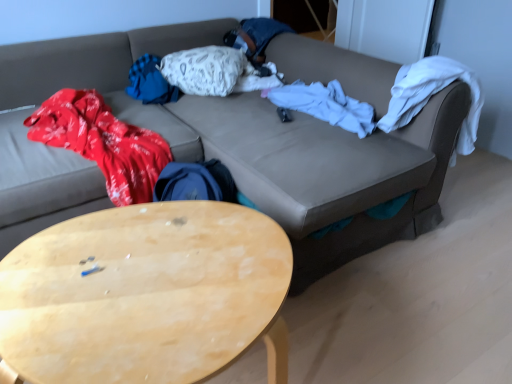
Identify the location of white soft blanket at center. The height and width of the screenshot is (384, 512). (325, 105).

Considering the points (218, 92) and (295, 100), which point is behind, point (218, 92) or point (295, 100)?

Positioned behind is point (218, 92).

Is white soft blanket at center completely or partially inside white textured pillow at center?

No, white soft blanket at center is located outside of white textured pillow at center.

Is white textured pillow at center with white soft blanket at center?

No, white textured pillow at center is not in contact with white soft blanket at center.

Is white textured pillow at center situated inside light wood/wooden coffee table at lower left or outside?

white textured pillow at center exists outside the volume of light wood/wooden coffee table at lower left.

Can you tell me how much white textured pillow at center and light wood/wooden coffee table at lower left differ in facing direction?

21.9 degrees.

Considering the relative sizes of white textured pillow at center and light wood/wooden coffee table at lower left in the image provided, is white textured pillow at center shorter than light wood/wooden coffee table at lower left?

Yes.

Is white textured pillow at center oriented towards light wood/wooden coffee table at lower left?

No, white textured pillow at center does not turn towards light wood/wooden coffee table at lower left.

Can you confirm if white textured pillow at center is positioned to the right of leather couch at center?

Yes, white textured pillow at center is to the right of leather couch at center.

Is white textured pillow at center wider than leather couch at center?

No.

From the image's perspective, relative to leather couch at center, is white textured pillow at center above or below?

From the image's perspective, white textured pillow at center appears above leather couch at center.

Is white textured pillow at center turned away from leather couch at center?

Absolutely, white textured pillow at center is directed away from leather couch at center.

You are a GUI agent. You are given a task and a screenshot of the screen. Output one action in this format:
    pyautogui.click(x=<x>, y=<y>)
    Task: Click on the pillow above the light wood/wooden coffee table at lower left (from the image's perspective)
    
    Given the screenshot: What is the action you would take?
    pos(206,70)

In the image, is light wood/wooden coffee table at lower left on the left side or the right side of white textured pillow at center?

Clearly, light wood/wooden coffee table at lower left is on the left of white textured pillow at center in the image.

Considering their positions, is light wood/wooden coffee table at lower left located in front of or behind white textured pillow at center?

In the image, light wood/wooden coffee table at lower left appears in front of white textured pillow at center.

Is light wood/wooden coffee table at lower left spatially inside white textured pillow at center, or outside of it?

light wood/wooden coffee table at lower left is spatially situated outside white textured pillow at center.

Can you confirm if leather couch at center is positioned to the right of white soft blanket at center?

Incorrect, leather couch at center is not on the right side of white soft blanket at center.

Is leather couch at center facing away from white soft blanket at center?

No, white soft blanket at center is not at the back of leather couch at center.

Which is farther, (219,137) or (298,92)?

The point (298,92) is behind.

From the image's perspective, is leather couch at center positioned above or below white soft blanket at center?

leather couch at center is below white soft blanket at center.

Considering the sizes of objects leather couch at center and light wood/wooden coffee table at lower left in the image provided, who is smaller, leather couch at center or light wood/wooden coffee table at lower left?

Smaller between the two is light wood/wooden coffee table at lower left.

Consider the image. Can you confirm if leather couch at center is shorter than light wood/wooden coffee table at lower left?

No, leather couch at center is not shorter than light wood/wooden coffee table at lower left.

Can you tell me how much leather couch at center and light wood/wooden coffee table at lower left differ in facing direction?

The angular difference between leather couch at center and light wood/wooden coffee table at lower left is 0.229 degrees.

From the image's perspective, which is above, white soft blanket at center or white textured pillow at center?

white textured pillow at center, from the image's perspective.

From a real-world perspective, between white soft blanket at center and white textured pillow at center, who is vertically lower?

white soft blanket at center, from a real-world perspective.

Is white soft blanket at center positioned behind white textured pillow at center?

No, white soft blanket at center is closer to the viewer.

Does white soft blanket at center turn towards white textured pillow at center?

No, white soft blanket at center is not oriented towards white textured pillow at center.

At what (x,y) coordinates should I click in order to perform the action: click on blanket below the white textured pillow at center (from a real-world perspective). Please return your answer as a coordinate pair (x, y). This screenshot has height=384, width=512. Looking at the image, I should click on click(325, 105).

This screenshot has height=384, width=512. I want to click on pillow on the right side of light wood/wooden coffee table at lower left, so click(206, 70).

When comparing their distances from leather couch at center, does white soft blanket at center or white textured pillow at center seem further?

Among the two, white textured pillow at center is located further to leather couch at center.

Estimate the real-world distances between objects in this image. Which object is further from light wood/wooden coffee table at lower left, white textured pillow at center or white soft blanket at center?

Based on the image, white textured pillow at center appears to be further to light wood/wooden coffee table at lower left.

Considering their positions, is white soft blanket at center positioned closer to light wood/wooden coffee table at lower left than white textured pillow at center?

white soft blanket at center lies closer to light wood/wooden coffee table at lower left than the other object.

Which object lies nearer to the anchor point light wood/wooden coffee table at lower left, leather couch at center or white textured pillow at center?

leather couch at center is positioned closer to the anchor light wood/wooden coffee table at lower left.

Based on their spatial positions, is leather couch at center or light wood/wooden coffee table at lower left further from white textured pillow at center?

light wood/wooden coffee table at lower left is further to white textured pillow at center.

Looking at the image, which one is located further to light wood/wooden coffee table at lower left, leather couch at center or white soft blanket at center?

white soft blanket at center.

In the scene shown: Looking at the image, which one is located further to white textured pillow at center, light wood/wooden coffee table at lower left or leather couch at center?

light wood/wooden coffee table at lower left is positioned further to the anchor white textured pillow at center.

From the image, which object appears to be nearer to leather couch at center, white soft blanket at center or light wood/wooden coffee table at lower left?

Based on the image, white soft blanket at center appears to be nearer to leather couch at center.

This screenshot has height=384, width=512. In order to click on studio couch between light wood/wooden coffee table at lower left and white soft blanket at center along the z-axis in this screenshot , I will do `click(264, 142)`.

What are the coordinates of `blanket positioned between light wood/wooden coffee table at lower left and white textured pillow at center from near to far` in the screenshot? It's located at (325, 105).

Where is `blanket located between leather couch at center and white textured pillow at center in the depth direction`? This screenshot has height=384, width=512. blanket located between leather couch at center and white textured pillow at center in the depth direction is located at coordinates (325, 105).

Find the location of a particular element. This screenshot has width=512, height=384. studio couch positioned between light wood/wooden coffee table at lower left and white textured pillow at center from near to far is located at coordinates (264, 142).